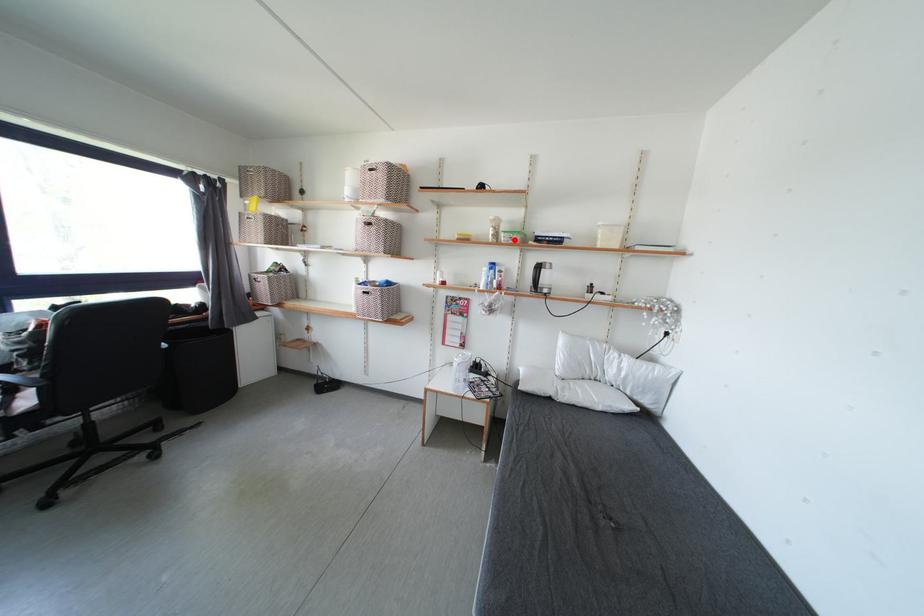
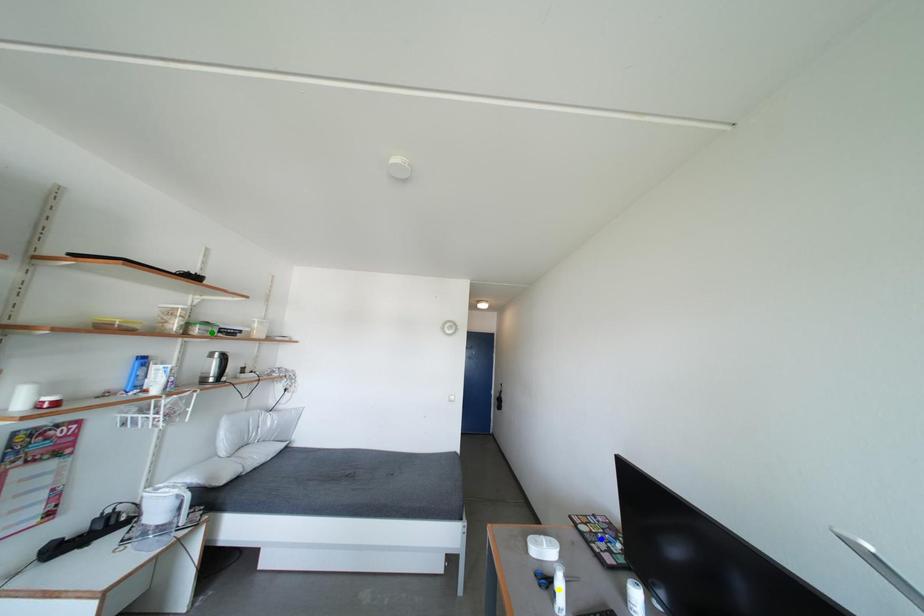
Question: I am providing you with two images of the same scene from different viewpoints. A red point is marked on the first image. You are given multiple points on the second image. Which point in image 2 represents the same 3d spot as the red point in image 1?

Choices:
 (A) yellow point
 (B) green point
 (C) blue point

Answer: (B)